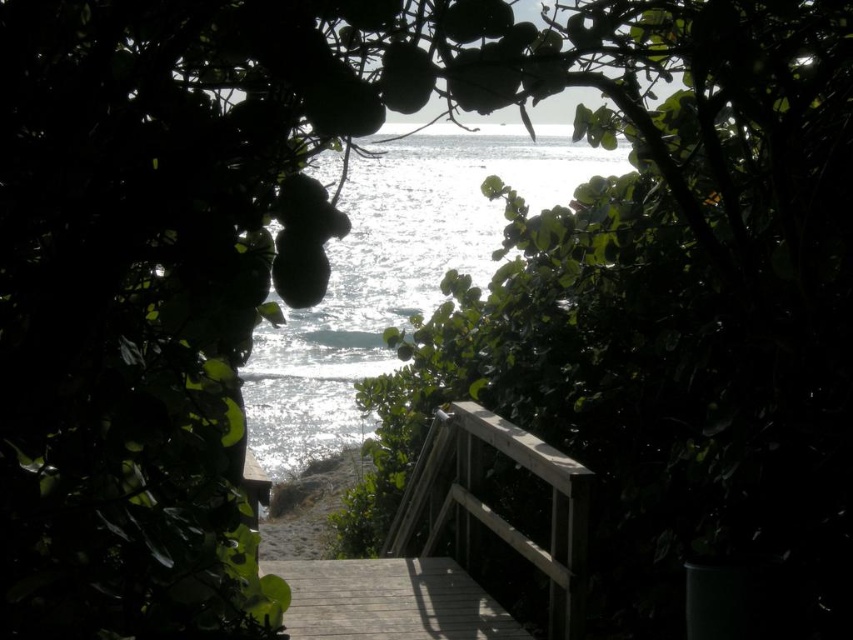
Question: Does wooden balustrade at center have a greater width compared to wooden deck at center?

Choices:
 (A) no
 (B) yes

Answer: (A)

Question: Among these objects, which one is farthest from the camera?

Choices:
 (A) wooden deck at center
 (B) wooden balustrade at center

Answer: (A)

Question: Which of the following is the farthest from the observer?

Choices:
 (A) wooden deck at center
 (B) wooden balustrade at center

Answer: (A)

Question: Can you confirm if wooden balustrade at center is wider than wooden deck at center?

Choices:
 (A) no
 (B) yes

Answer: (A)

Question: Which object is closer to the camera taking this photo?

Choices:
 (A) wooden deck at center
 (B) wooden balustrade at center

Answer: (B)

Question: Does wooden balustrade at center come in front of wooden deck at center?

Choices:
 (A) yes
 (B) no

Answer: (A)